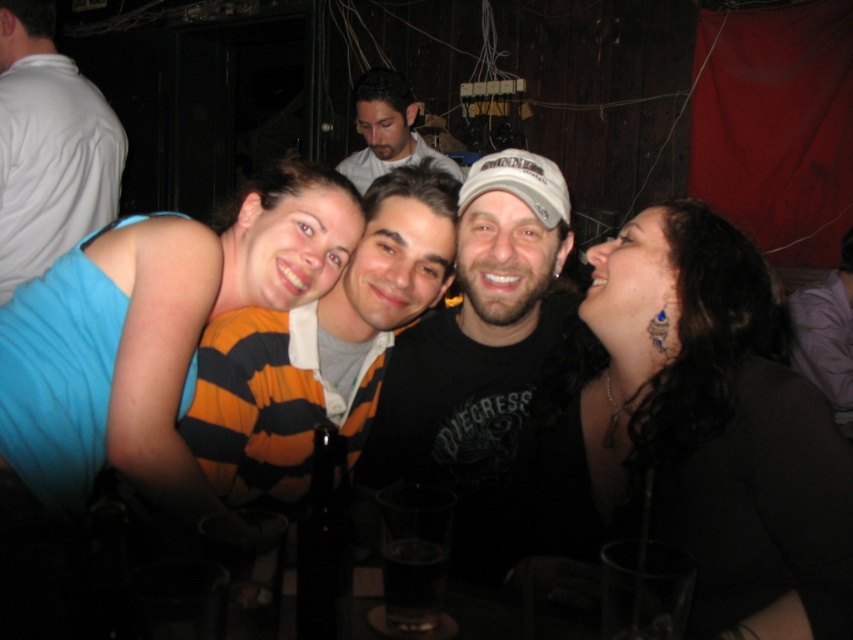
You are taking a photo of two points in the image. The first point is at coordinate point[477,576] and the second is at point[790,320]. Based on their positions, which point is closer to you?

Point[477,576] is closer to the camera than point[790,320].

You are at a party and want to find the person wearing the purple fabric shirt at right. Which direction should you look relative to the smooth gray shirt at center?

The purple fabric shirt at right is smaller than the smooth gray shirt at center, so look to the right of the smooth gray shirt at center to find the smaller purple fabric shirt at right.